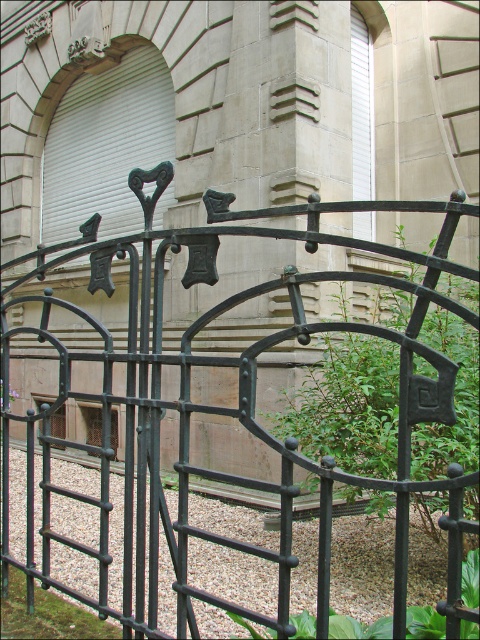
Who is positioned more to the left, black wrought iron gate at center or smooth gravel at center?

Positioned to the left is black wrought iron gate at center.

The height and width of the screenshot is (640, 480). What do you see at coordinates (225, 406) in the screenshot?
I see `black wrought iron gate at center` at bounding box center [225, 406].

Find the location of a particular element. black wrought iron gate at center is located at coordinates (225, 406).